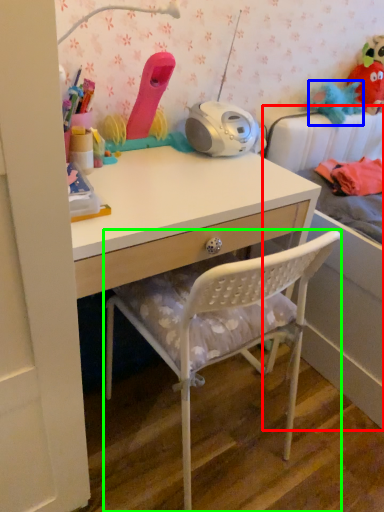
Question: Estimate the real-world distances between objects in this image. Which object is closer to bed (highlighted by a red box), toy (highlighted by a blue box) or chair (highlighted by a green box)?

Choices:
 (A) toy
 (B) chair

Answer: (B)